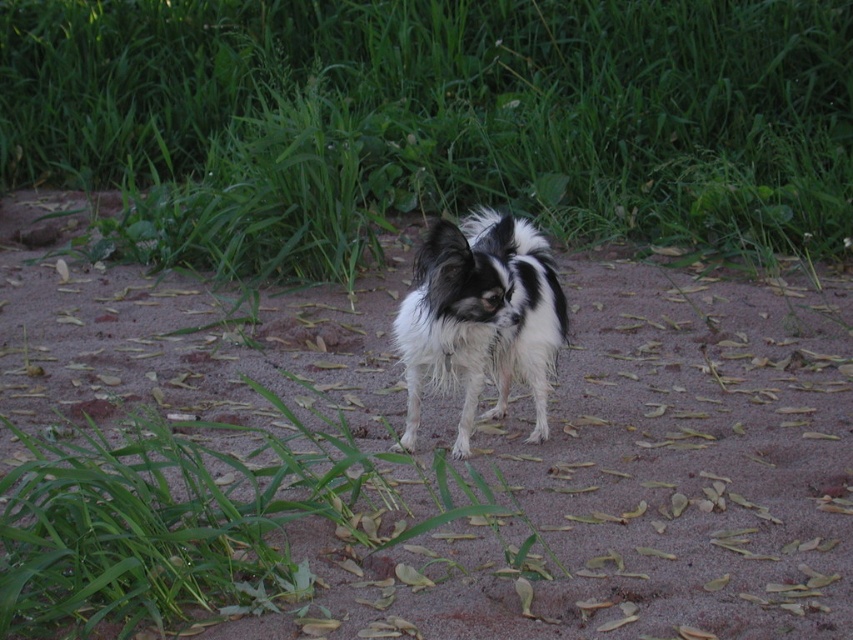
Looking at this image, you are a small dog standing on the brown sandy ground at center and looking towards the green leafy grass at center. Which part of the ground do you see closer to your eyes?

The green leafy grass at center is closer to your eyes because it is positioned further to the viewer than the brown sandy ground at center, making it appear nearer in your line of sight.